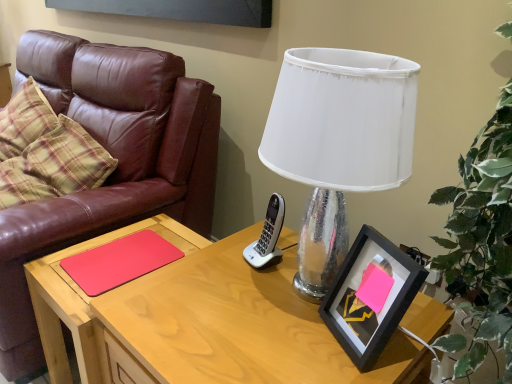
Where is `empty space that is ontop of matte pink notepad at center (from a real-world perspective)`? The height and width of the screenshot is (384, 512). empty space that is ontop of matte pink notepad at center (from a real-world perspective) is located at coordinates (124, 254).